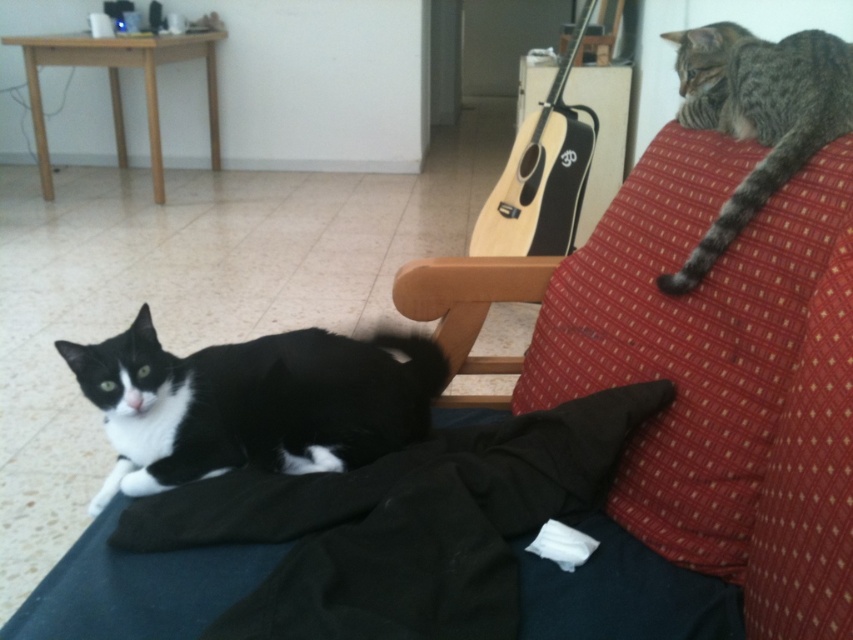
Question: Does red textured pillow at upper right have a greater width compared to tabby fur cat at upper right?

Choices:
 (A) no
 (B) yes

Answer: (B)

Question: Which of the following is the farthest from the observer?

Choices:
 (A) (668, 253)
 (B) (759, 198)
 (C) (519, 237)
 (D) (154, 401)

Answer: (C)

Question: Estimate the real-world distances between objects in this image. Which object is farther from the red textured pillow at upper right?

Choices:
 (A) tabby fur cat at upper right
 (B) black and white fur cat at lower left

Answer: (B)

Question: Is red textured pillow at upper right to the right of light wood acoustic guitar at upper center from the viewer's perspective?

Choices:
 (A) no
 (B) yes

Answer: (A)

Question: Which object appears farthest from the camera in this image?

Choices:
 (A) light wood acoustic guitar at upper center
 (B) tabby fur cat at upper right
 (C) red textured pillow at upper right

Answer: (A)

Question: Is tabby fur cat at upper right wider than light wood acoustic guitar at upper center?

Choices:
 (A) yes
 (B) no

Answer: (B)